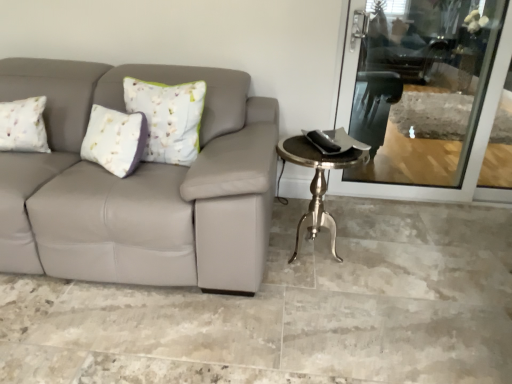
Question: From a real-world perspective, is metallic silver swivel chair at upper right physically above transparent glass screen door at upper right?

Choices:
 (A) no
 (B) yes

Answer: (B)

Question: Is transparent glass screen door at upper right inside metallic silver swivel chair at upper right?

Choices:
 (A) yes
 (B) no

Answer: (B)

Question: Is metallic silver swivel chair at upper right directly adjacent to transparent glass screen door at upper right?

Choices:
 (A) yes
 (B) no

Answer: (B)

Question: Can you confirm if metallic silver swivel chair at upper right is bigger than transparent glass screen door at upper right?

Choices:
 (A) no
 (B) yes

Answer: (B)

Question: Considering the relative positions of metallic silver swivel chair at upper right and transparent glass screen door at upper right in the image provided, is metallic silver swivel chair at upper right to the right of transparent glass screen door at upper right from the viewer's perspective?

Choices:
 (A) no
 (B) yes

Answer: (B)

Question: From a real-world perspective, relative to metallic silver swivel chair at upper right, is transparent glass screen door at upper right vertically above or below?

Choices:
 (A) below
 (B) above

Answer: (A)

Question: Based on their positions, is transparent glass screen door at upper right located to the left or right of metallic silver swivel chair at upper right?

Choices:
 (A) right
 (B) left

Answer: (B)

Question: Is transparent glass screen door at upper right wider or thinner than metallic silver swivel chair at upper right?

Choices:
 (A) wide
 (B) thin

Answer: (B)

Question: From their relative heights in the image, would you say transparent glass screen door at upper right is taller or shorter than metallic silver swivel chair at upper right?

Choices:
 (A) short
 (B) tall

Answer: (B)

Question: Is transparent glass screen door at upper right taller or shorter than silver metallic table at right?

Choices:
 (A) tall
 (B) short

Answer: (A)

Question: From a real-world perspective, is transparent glass screen door at upper right above or below silver metallic table at right?

Choices:
 (A) below
 (B) above

Answer: (B)

Question: Based on their sizes in the image, would you say transparent glass screen door at upper right is bigger or smaller than silver metallic table at right?

Choices:
 (A) small
 (B) big

Answer: (A)

Question: Considering the relative positions of transparent glass screen door at upper right and silver metallic table at right in the image provided, is transparent glass screen door at upper right to the left or to the right of silver metallic table at right?

Choices:
 (A) left
 (B) right

Answer: (B)

Question: Considering the positions of silver metallic table at right and metallic silver swivel chair at upper right in the image, is silver metallic table at right wider or thinner than metallic silver swivel chair at upper right?

Choices:
 (A) wide
 (B) thin

Answer: (B)

Question: In the image, is silver metallic table at right positioned in front of or behind metallic silver swivel chair at upper right?

Choices:
 (A) behind
 (B) front

Answer: (B)